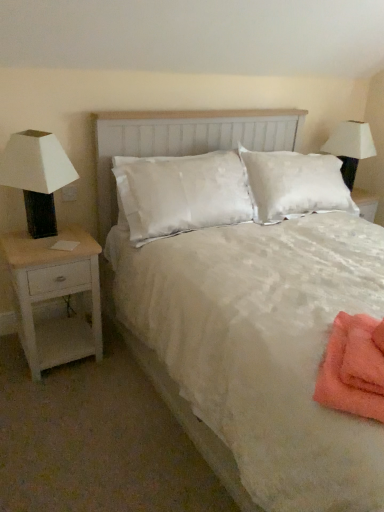
Question: Does white matte table lamp at left come behind orange towel at lower right?

Choices:
 (A) no
 (B) yes

Answer: (B)

Question: Is white matte table lamp at left facing towards orange towel at lower right?

Choices:
 (A) yes
 (B) no

Answer: (A)

Question: Can you confirm if white matte table lamp at left is positioned to the right of orange towel at lower right?

Choices:
 (A) yes
 (B) no

Answer: (B)

Question: Is white matte table lamp at left bigger than orange towel at lower right?

Choices:
 (A) yes
 (B) no

Answer: (A)

Question: Would you consider white matte table lamp at left to be distant from orange towel at lower right?

Choices:
 (A) yes
 (B) no

Answer: (A)

Question: Is white satin bed at center in front of or behind white matte table lamp at left in the image?

Choices:
 (A) front
 (B) behind

Answer: (A)

Question: Based on their sizes in the image, would you say white satin bed at center is bigger or smaller than white matte table lamp at left?

Choices:
 (A) small
 (B) big

Answer: (B)

Question: From the image's perspective, is white satin bed at center above or below white matte table lamp at left?

Choices:
 (A) above
 (B) below

Answer: (B)

Question: From a real-world perspective, is white satin bed at center physically located above or below white matte table lamp at left?

Choices:
 (A) above
 (B) below

Answer: (B)

Question: Considering the positions of point (180, 131) and point (61, 250), is point (180, 131) closer or farther from the camera than point (61, 250)?

Choices:
 (A) farther
 (B) closer

Answer: (A)

Question: Considering their positions, is white satin bed at center located in front of or behind white wood nightstand at left?

Choices:
 (A) front
 (B) behind

Answer: (A)

Question: In terms of height, does white satin bed at center look taller or shorter compared to white wood nightstand at left?

Choices:
 (A) short
 (B) tall

Answer: (B)

Question: From the image's perspective, is white satin bed at center located above or below white wood nightstand at left?

Choices:
 (A) below
 (B) above

Answer: (B)

Question: Considering the relative positions of white matte table lamp at left and white fabric lampshade at upper right in the image provided, is white matte table lamp at left to the left or to the right of white fabric lampshade at upper right?

Choices:
 (A) left
 (B) right

Answer: (A)

Question: From the image's perspective, is white matte table lamp at left located above or below white fabric lampshade at upper right?

Choices:
 (A) above
 (B) below

Answer: (B)